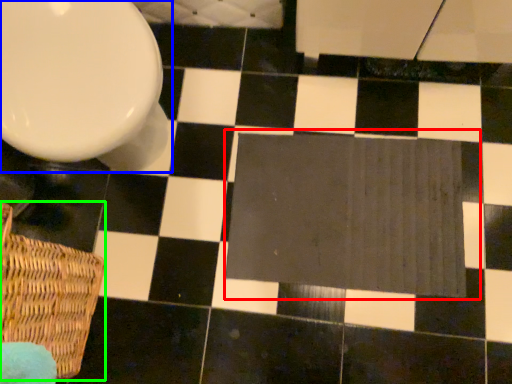
Question: Based on their relative distances, which object is nearer to bath mat (highlighted by a red box)? Choose from toilet (highlighted by a blue box) and basket (highlighted by a green box).

Choices:
 (A) toilet
 (B) basket

Answer: (A)